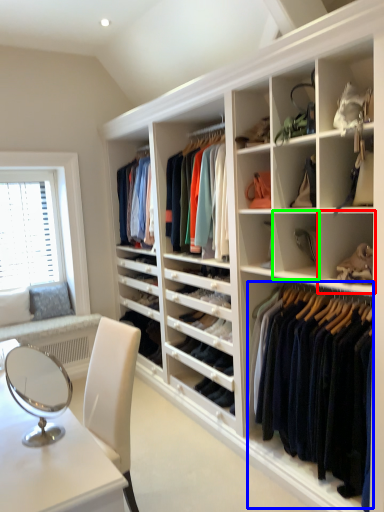
Question: Based on their relative distances, which object is farther from shelf (highlighted by a red box)? Choose from clothing (highlighted by a blue box) and shelf (highlighted by a green box).

Choices:
 (A) clothing
 (B) shelf

Answer: (A)